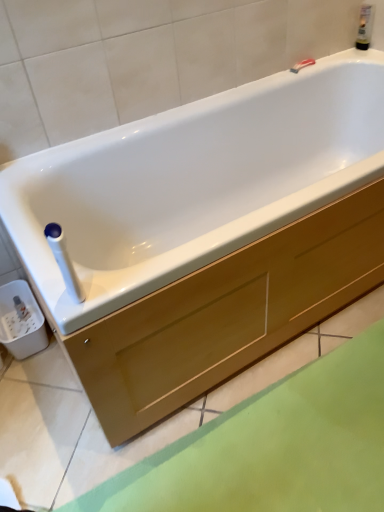
Consider the image. Measure the distance between point (179, 357) and camera.

The depth of point (179, 357) is 3.65 feet.

Where is `white plastic towel bar at upper left`? white plastic towel bar at upper left is located at coordinates (64, 261).

What are the coordinates of `matte wood drawer at center` in the screenshot? It's located at (228, 314).

Would you consider translucent plastic bottle at upper right to be distant from white plastic towel bar at upper left?

That's right, there is a large distance between translucent plastic bottle at upper right and white plastic towel bar at upper left.

Is translucent plastic bottle at upper right facing away from white plastic towel bar at upper left?

translucent plastic bottle at upper right is not turned away from white plastic towel bar at upper left.

Is white plastic towel bar at upper left surrounded by translucent plastic bottle at upper right?

No, white plastic towel bar at upper left is located outside of translucent plastic bottle at upper right.

Considering the relative sizes of translucent plastic bottle at upper right and white plastic towel bar at upper left in the image provided, is translucent plastic bottle at upper right smaller than white plastic towel bar at upper left?

Correct, translucent plastic bottle at upper right occupies less space than white plastic towel bar at upper left.

In the scene shown: From the image's perspective, does translucent plastic bottle at upper right appear lower than matte wood drawer at center?

Incorrect, from the image's perspective, translucent plastic bottle at upper right is higher than matte wood drawer at center.

Considering the sizes of objects translucent plastic bottle at upper right and matte wood drawer at center in the image provided, who is shorter, translucent plastic bottle at upper right or matte wood drawer at center?

matte wood drawer at center.

Where is `bottle above the matte wood drawer at center (from a real-world perspective)`? The image size is (384, 512). bottle above the matte wood drawer at center (from a real-world perspective) is located at coordinates (365, 26).

Between translucent plastic bottle at upper right and matte wood drawer at center, which one has larger width?

matte wood drawer at center.

Is white plastic towel bar at upper left positioned with its back to translucent plastic bottle at upper right?

No, white plastic towel bar at upper left is not facing the opposite direction of translucent plastic bottle at upper right.

Is white plastic towel bar at upper left shorter than translucent plastic bottle at upper right?

No.

Which is correct: white plastic towel bar at upper left is inside translucent plastic bottle at upper right, or outside of it?

The correct answer is: outside.

How different are the orientations of white plastic towel bar at upper left and translucent plastic bottle at upper right in degrees?

white plastic towel bar at upper left and translucent plastic bottle at upper right are facing 0.73 degrees away from each other.

Between matte wood drawer at center and white plastic towel bar at upper left, which one appears on the left side from the viewer's perspective?

Positioned to the left is white plastic towel bar at upper left.

Is matte wood drawer at center looking in the opposite direction of white plastic towel bar at upper left?

That's not correct — matte wood drawer at center is not looking away from white plastic towel bar at upper left.

Considering the sizes of matte wood drawer at center and white plastic towel bar at upper left in the image, is matte wood drawer at center wider or thinner than white plastic towel bar at upper left?

Considering their sizes, matte wood drawer at center looks broader than white plastic towel bar at upper left.

What's the angular difference between matte wood drawer at center and white plastic towel bar at upper left's facing directions?

They differ by 88 degrees in their facing directions.

Which object is closer to the camera taking this photo, matte wood drawer at center or translucent plastic bottle at upper right?

matte wood drawer at center is more forward.

Considering the points (161, 322) and (366, 37), which point is behind, point (161, 322) or point (366, 37)?

The point (366, 37) is farther.

Where is `drawer below the translucent plastic bottle at upper right (from a real-world perspective)`? Image resolution: width=384 pixels, height=512 pixels. drawer below the translucent plastic bottle at upper right (from a real-world perspective) is located at coordinates (228, 314).

Is matte wood drawer at center located outside translucent plastic bottle at upper right?

Yes, matte wood drawer at center is located beyond the bounds of translucent plastic bottle at upper right.

Can you confirm if white plastic towel bar at upper left is positioned to the right of matte wood drawer at center?

In fact, white plastic towel bar at upper left is to the left of matte wood drawer at center.

Measure the distance from white plastic towel bar at upper left to matte wood drawer at center.

They are 48.38 centimeters apart.

Between white plastic towel bar at upper left and matte wood drawer at center, which one has smaller size?

white plastic towel bar at upper left.

Is white plastic towel bar at upper left oriented towards matte wood drawer at center?

No, white plastic towel bar at upper left is not aimed at matte wood drawer at center.

This screenshot has width=384, height=512. I want to click on towel bar directly beneath the translucent plastic bottle at upper right (from a real-world perspective), so click(64, 261).

Identify the location of drawer that is on the left side of translucent plastic bottle at upper right. (228, 314).

When comparing their distances from white plastic towel bar at upper left, does translucent plastic bottle at upper right or matte wood drawer at center seem closer?

Based on the image, matte wood drawer at center appears to be nearer to white plastic towel bar at upper left.

Looking at the image, which one is located further to matte wood drawer at center, white plastic towel bar at upper left or translucent plastic bottle at upper right?

The object further to matte wood drawer at center is translucent plastic bottle at upper right.

In the scene shown: Considering their positions, is translucent plastic bottle at upper right positioned closer to matte wood drawer at center than white plastic towel bar at upper left?

Based on the image, white plastic towel bar at upper left appears to be nearer to matte wood drawer at center.

Which object lies further to the anchor point translucent plastic bottle at upper right, white plastic towel bar at upper left or matte wood drawer at center?

white plastic towel bar at upper left lies further to translucent plastic bottle at upper right than the other object.

From the image, which object appears to be farther from white plastic towel bar at upper left, matte wood drawer at center or translucent plastic bottle at upper right?

translucent plastic bottle at upper right lies further to white plastic towel bar at upper left than the other object.

From the image, which object appears to be nearer to translucent plastic bottle at upper right, matte wood drawer at center or white plastic towel bar at upper left?

The object closer to translucent plastic bottle at upper right is matte wood drawer at center.

Find the location of a particular element. The width and height of the screenshot is (384, 512). towel bar that lies between translucent plastic bottle at upper right and matte wood drawer at center from top to bottom is located at coordinates (64, 261).